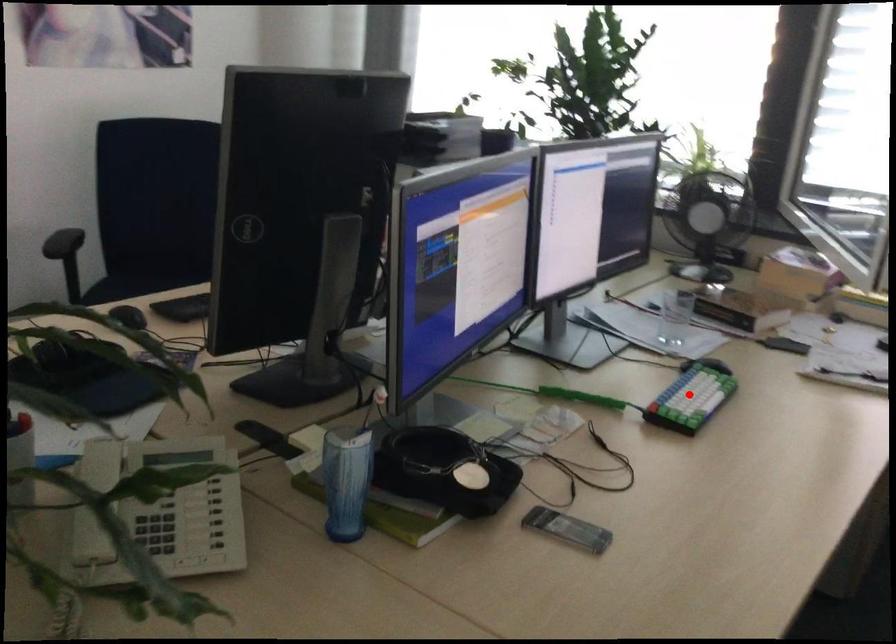
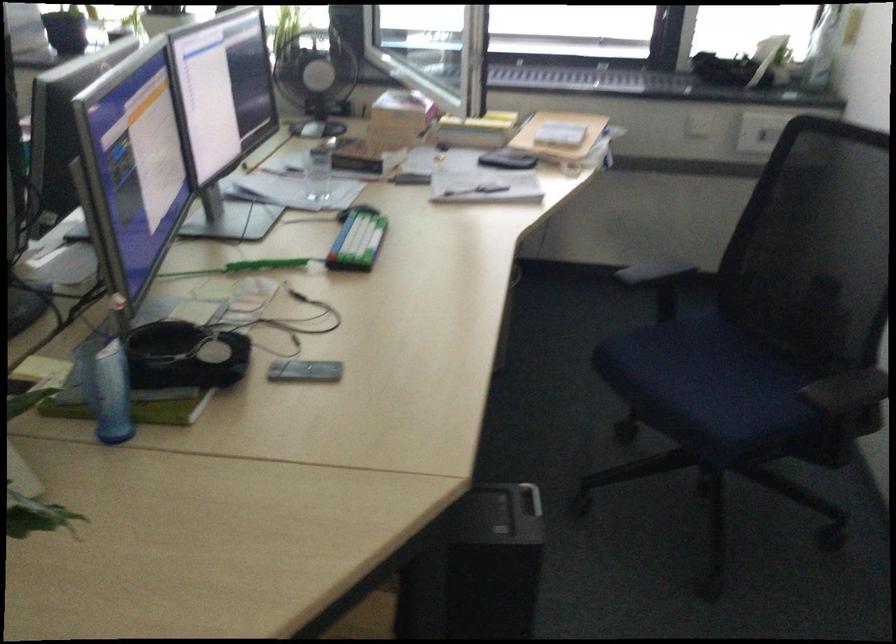
Question: I am providing you with two images of the same scene from different viewpoints. A red point is marked on the first image. At the location where the point appears in image 1, is it still visible in image 2?

Choices:
 (A) Yes
 (B) No

Answer: (A)